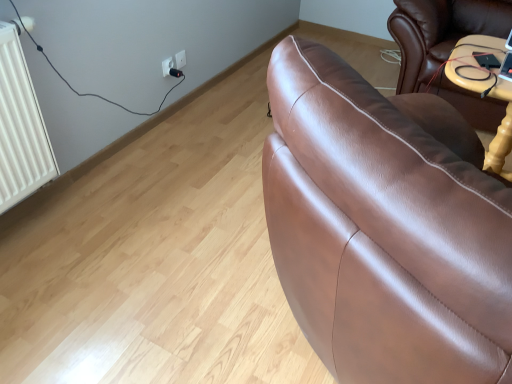
Question: Are black plastic plug at upper center and white plastic socket at upper left, acting as the 1th electric outlet starting from the right, making contact?

Choices:
 (A) yes
 (B) no

Answer: (A)

Question: Is black plastic plug at upper center not close to white plastic socket at upper left, acting as the 1th electric outlet starting from the right?

Choices:
 (A) yes
 (B) no

Answer: (B)

Question: Is black plastic plug at upper center turned away from white plastic socket at upper left, the second electric outlet positioned from the left?

Choices:
 (A) yes
 (B) no

Answer: (B)

Question: Is black plastic plug at upper center to the right of white plastic socket at upper left, acting as the 1th electric outlet starting from the right, from the viewer's perspective?

Choices:
 (A) yes
 (B) no

Answer: (B)

Question: Can you confirm if black plastic plug at upper center is smaller than white plastic socket at upper left, the second electric outlet positioned from the left?

Choices:
 (A) no
 (B) yes

Answer: (A)

Question: Considering the relative positions of black plastic plug at upper center and white plastic socket at upper left, acting as the 1th electric outlet starting from the right, in the image provided, is black plastic plug at upper center behind white plastic socket at upper left, acting as the 1th electric outlet starting from the right,?

Choices:
 (A) no
 (B) yes

Answer: (A)

Question: Is white plastic socket at upper center, which is the 1th electric outlet from left to right, behind white plastic socket at upper left, the second electric outlet positioned from the left?

Choices:
 (A) no
 (B) yes

Answer: (A)

Question: From a real-world perspective, is white plastic socket at upper center, the second electric outlet when ordered from right to left, beneath white plastic socket at upper left, acting as the 1th electric outlet starting from the right?

Choices:
 (A) yes
 (B) no

Answer: (A)

Question: Can you confirm if white plastic socket at upper center, which is the 1th electric outlet from left to right, is wider than white plastic socket at upper left, the second electric outlet positioned from the left?

Choices:
 (A) no
 (B) yes

Answer: (B)

Question: Is the position of white plastic socket at upper center, which is the 1th electric outlet from left to right, less distant than that of white plastic socket at upper left, the second electric outlet positioned from the left?

Choices:
 (A) no
 (B) yes

Answer: (B)

Question: Considering the relative sizes of white plastic socket at upper center, the second electric outlet when ordered from right to left, and white plastic socket at upper left, the second electric outlet positioned from the left, in the image provided, is white plastic socket at upper center, the second electric outlet when ordered from right to left, thinner than white plastic socket at upper left, the second electric outlet positioned from the left,?

Choices:
 (A) yes
 (B) no

Answer: (B)

Question: Could white plastic socket at upper left, the second electric outlet positioned from the left, be considered to be inside white plastic socket at upper center, the second electric outlet when ordered from right to left?

Choices:
 (A) no
 (B) yes

Answer: (A)

Question: Is white plastic socket at upper left, the second electric outlet positioned from the left, further to the viewer compared to white plastic socket at upper center, the second electric outlet when ordered from right to left?

Choices:
 (A) yes
 (B) no

Answer: (A)